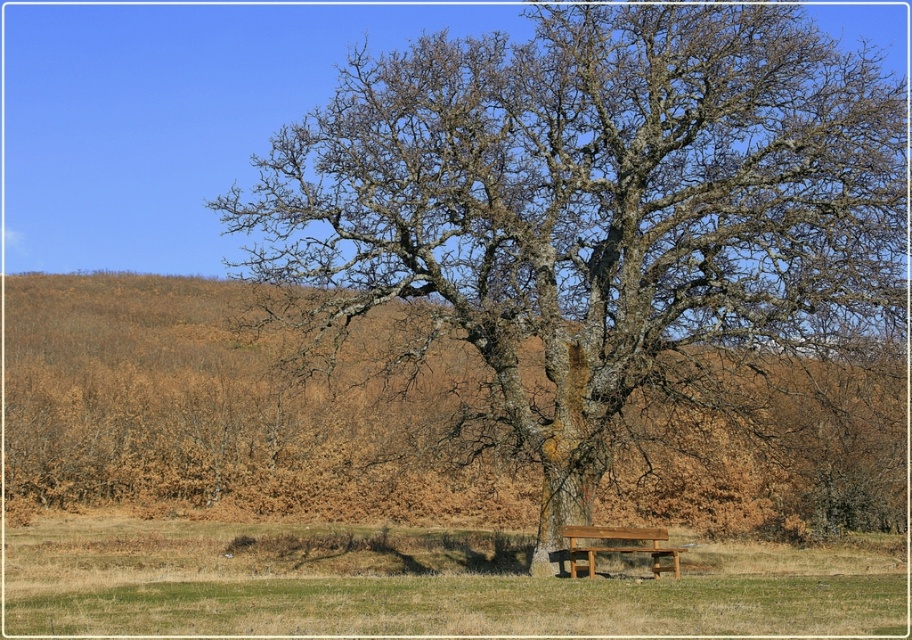
Question: Which object is closer to the camera taking this photo?

Choices:
 (A) smooth bark tree at center
 (B) brown dry grass at center

Answer: (A)

Question: Can you confirm if smooth bark tree at center is positioned to the left of brown wooden bench at center?

Choices:
 (A) no
 (B) yes

Answer: (B)

Question: Which point appears farthest from the camera in this image?

Choices:
 (A) (627, 284)
 (B) (625, 548)
 (C) (247, 326)

Answer: (C)

Question: Considering the real-world distances, which object is farthest from the green grass at lower center?

Choices:
 (A) brown dry grass at center
 (B) smooth bark tree at center

Answer: (B)

Question: Is green grass at lower center bigger than brown wooden bench at center?

Choices:
 (A) no
 (B) yes

Answer: (B)

Question: Can you confirm if smooth bark tree at center is smaller than brown dry grass at center?

Choices:
 (A) no
 (B) yes

Answer: (A)